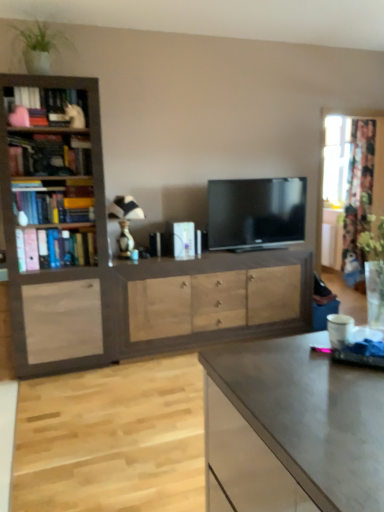
Question: From the image's perspective, is light wood drawer at center located above or below white striped fabric lampshade at center?

Choices:
 (A) below
 (B) above

Answer: (A)

Question: Is light wood drawer at center to the left or to the right of white striped fabric lampshade at center in the image?

Choices:
 (A) right
 (B) left

Answer: (A)

Question: Which is farther from the hardcover books at left?

Choices:
 (A) matte gray desk at lower right
 (B) wooden bookcase at left
 (C) light wood drawer at center
 (D) green leafy plant at upper left
 (E) black glossy tv at center

Answer: (A)

Question: Which of these objects is positioned farthest from the black glossy tv at center?

Choices:
 (A) hardcover books at left
 (B) green leafy plant at upper left
 (C) light wood drawer at center
 (D) matte gray desk at lower right
 (E) floral fabric curtain at right

Answer: (D)